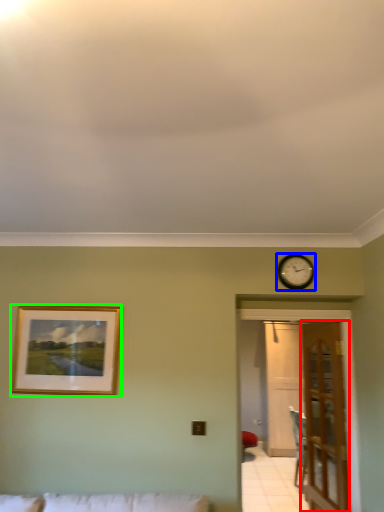
Question: Which is farther away from door (highlighted by a red box)? wall clock (highlighted by a blue box) or picture frame (highlighted by a green box)?

Choices:
 (A) wall clock
 (B) picture frame

Answer: (B)